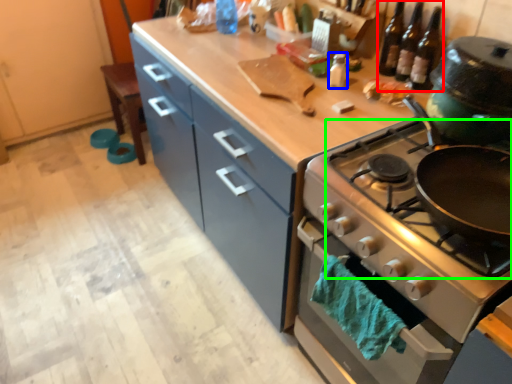
Question: Which object is positioned farthest from wine bottle (highlighted by a red box)? Select from bottle (highlighted by a blue box) and gas stove (highlighted by a green box).

Choices:
 (A) bottle
 (B) gas stove

Answer: (B)